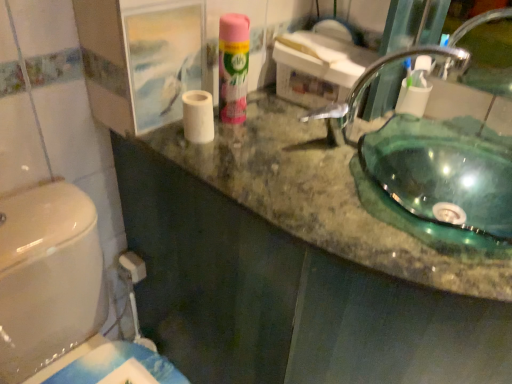
Locate an element on the screen. free point in front of white matte toilet paper at center, marked as the 1th toilet paper in a front-to-back arrangement is located at coordinates (217, 167).